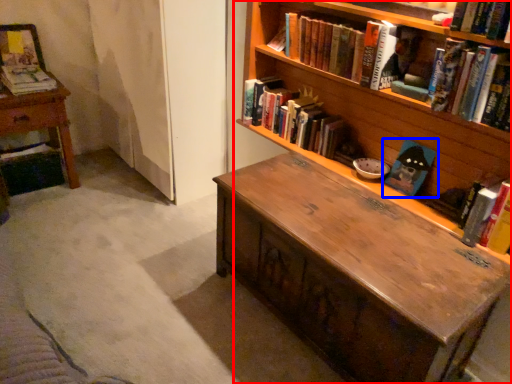
Question: Which point is closer to the camera, bookcase (highlighted by a red box) or book (highlighted by a blue box)?

Choices:
 (A) bookcase
 (B) book

Answer: (A)